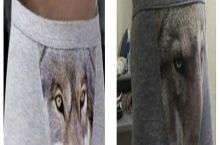
Locate an element on the screen. The width and height of the screenshot is (220, 145). 2 shelfs in background is located at coordinates (123, 70), (125, 102).